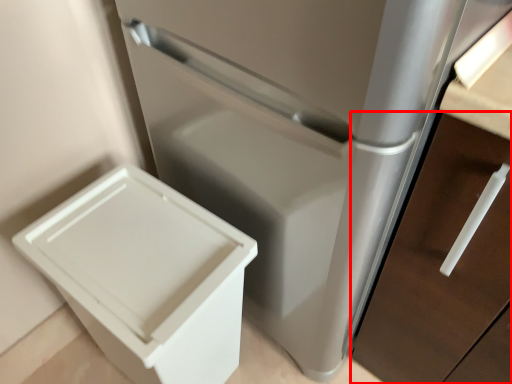
Question: From the image's perspective, what is the correct spatial relationship of drawer (annotated by the red box) in relation to waste container?

Choices:
 (A) below
 (B) above

Answer: (B)